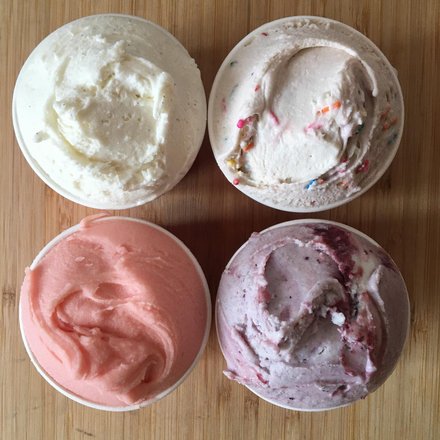
The image size is (440, 440). Identify the location of clear table space to right of ice cream. (413, 204).